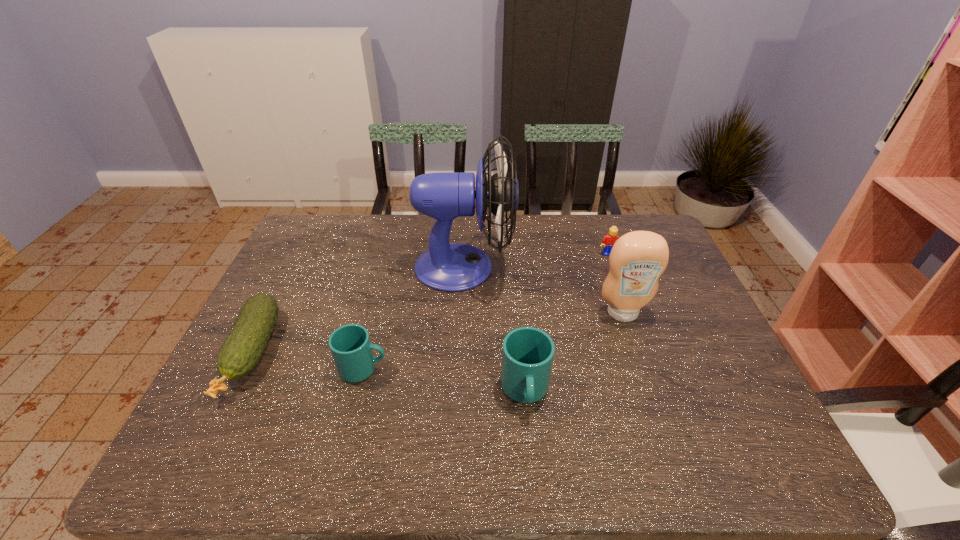
Where is `free space located on the front-facing side of the Lego`? free space located on the front-facing side of the Lego is located at coordinates tap(643, 351).

Where is `free location located on the label of the fifth shortest object`? free location located on the label of the fifth shortest object is located at coordinates (650, 394).

I want to click on vacant position located in front of the fan where the airflow is directed, so click(x=574, y=267).

The image size is (960, 540). What are the coordinates of `blank area located 0.050m at the blossom end of the leftmost object` in the screenshot? It's located at (215, 427).

Identify the location of Lego at the far edge. This screenshot has height=540, width=960. (608, 241).

The image size is (960, 540). I want to click on fan that is positioned at the far edge, so click(x=454, y=267).

This screenshot has width=960, height=540. Find the location of `cup located at the near edge`. cup located at the near edge is located at coordinates click(x=527, y=356).

At what (x,y) coordinates should I click in order to perform the action: click on cucumber present at the near edge. Please return your answer as a coordinate pair (x, y). The image size is (960, 540). Looking at the image, I should click on (241, 351).

Image resolution: width=960 pixels, height=540 pixels. In order to click on object at the left edge in this screenshot , I will do `click(241, 351)`.

Where is `object that is at the right edge`? This screenshot has height=540, width=960. object that is at the right edge is located at coordinates (638, 258).